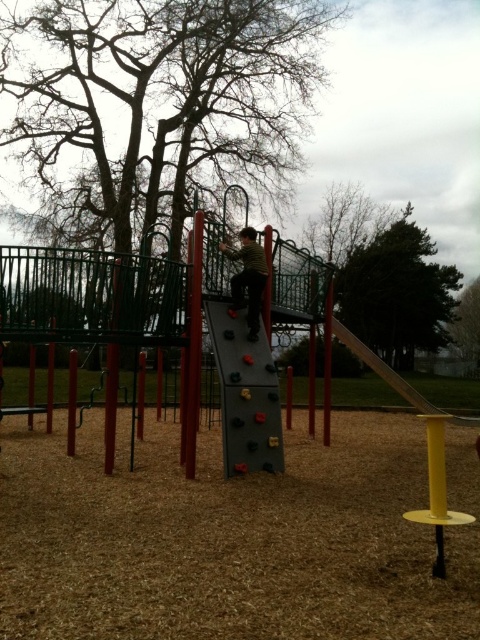
Question: Is striped shirt at center wider than yellow metallic pole at right?

Choices:
 (A) no
 (B) yes

Answer: (A)

Question: Estimate the real-world distances between objects in this image. Which object is farther from the metallic silver slide at right?

Choices:
 (A) yellow metallic pole at right
 (B) striped shirt at center

Answer: (B)

Question: From the image, what is the correct spatial relationship of smooth red pole at center in relation to metallic silver slide at right?

Choices:
 (A) below
 (B) above

Answer: (B)

Question: Which object is the closest to the striped shirt at center?

Choices:
 (A) yellow metallic pole at right
 (B) metallic silver slide at right
 (C) smooth red pole at center

Answer: (C)

Question: Which object is closer to the camera taking this photo?

Choices:
 (A) striped shirt at center
 (B) smooth red pole at center

Answer: (B)

Question: Can you confirm if smooth red pole at center is positioned below metallic silver slide at right?

Choices:
 (A) no
 (B) yes

Answer: (A)